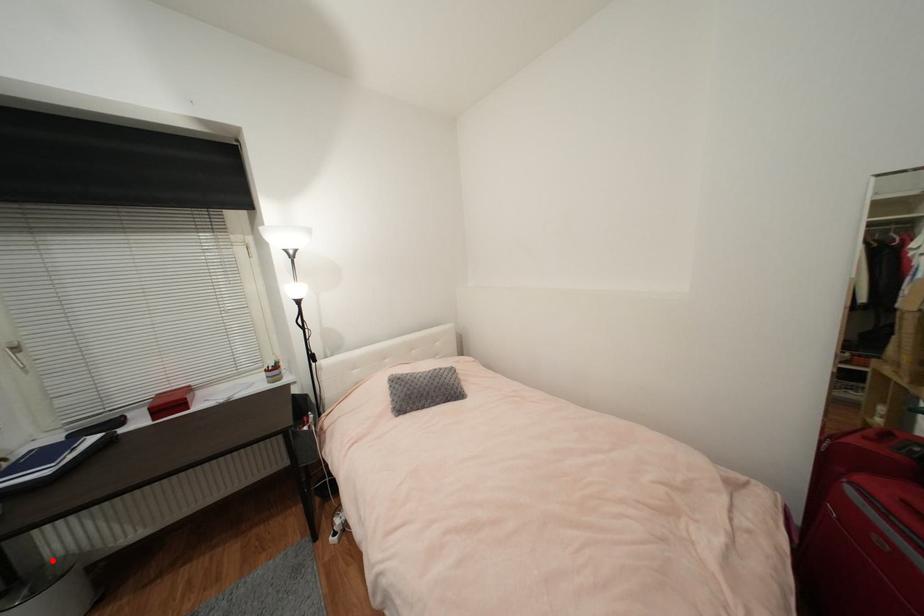
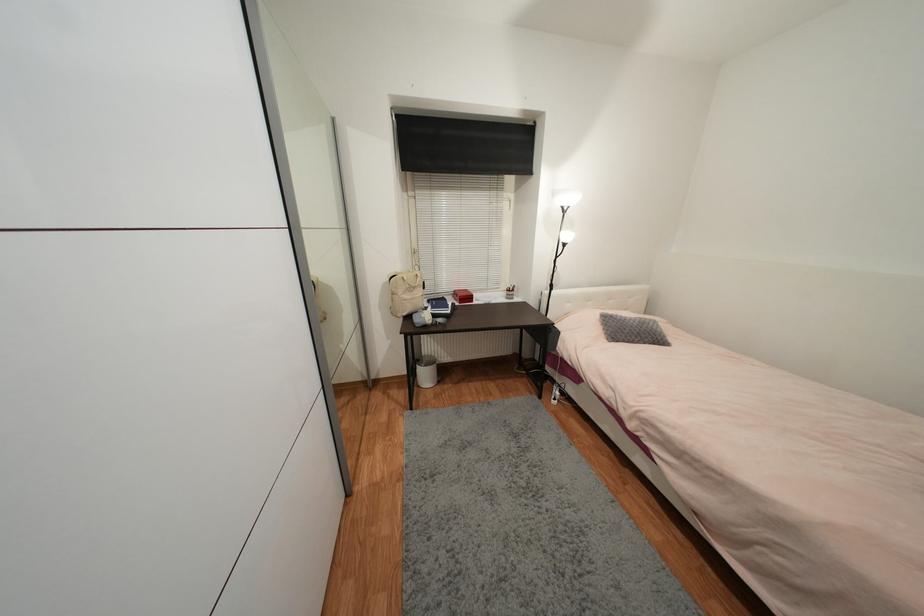
Question: I am providing you with two images of the same scene from different viewpoints. A red point is shown in image1. For the corresponding object point in image2, is it positioned nearer or farther from the camera?

Choices:
 (A) Nearer
 (B) Farther

Answer: (B)